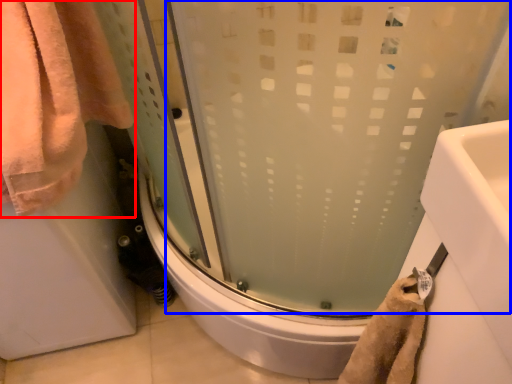
Question: Among these objects, which one is nearest to the camera, towel (highlighted by a red box) or shower door (highlighted by a blue box)?

Choices:
 (A) towel
 (B) shower door

Answer: (A)